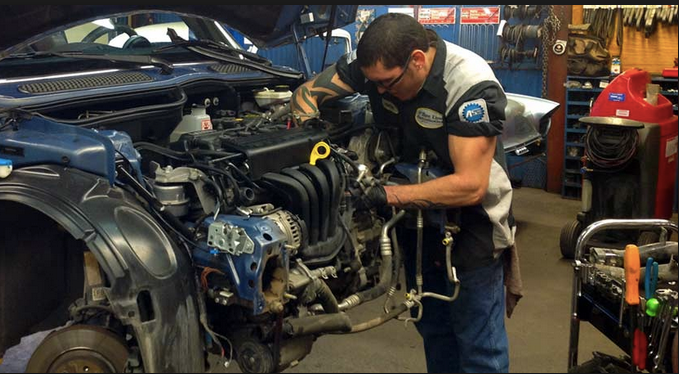
The image size is (679, 374). In order to click on empty space on floor in this screenshot , I will do pyautogui.click(x=549, y=293).